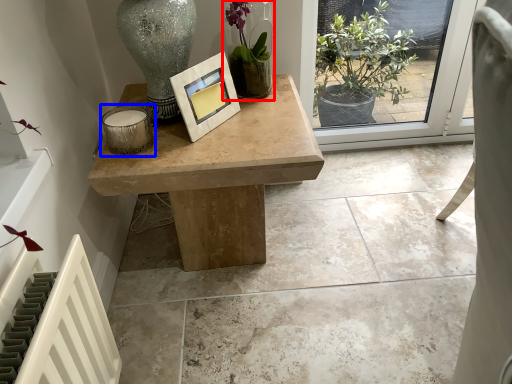
Question: Among these objects, which one is farthest to the camera, houseplant (highlighted by a red box) or candle holder (highlighted by a blue box)?

Choices:
 (A) houseplant
 (B) candle holder

Answer: (A)